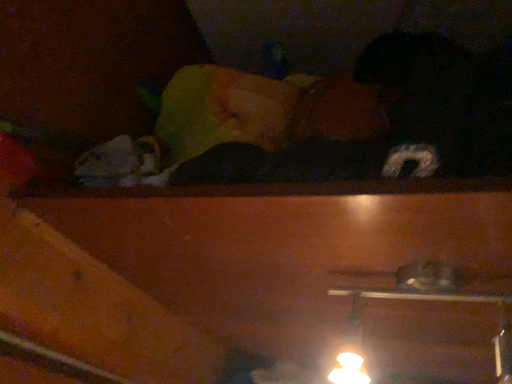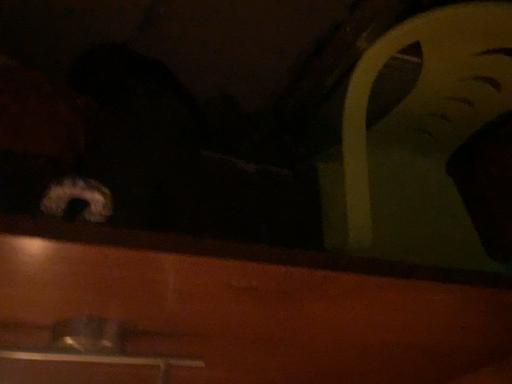
Question: Which way did the camera rotate in the video?

Choices:
 (A) rotated right
 (B) rotated left

Answer: (A)